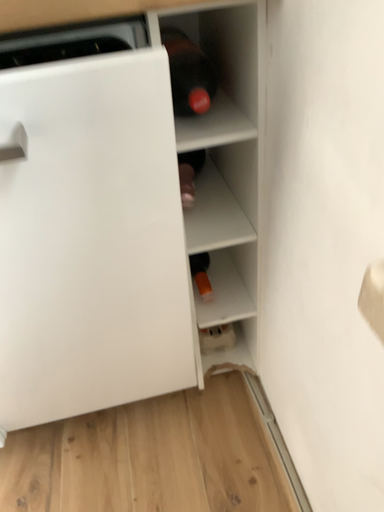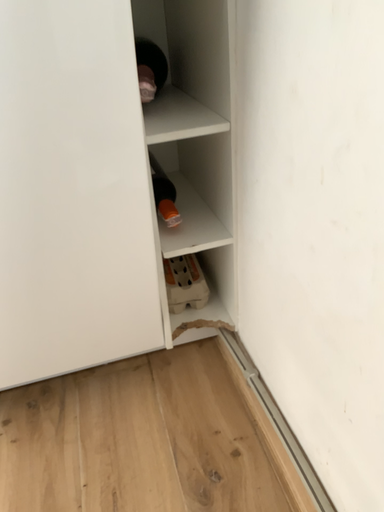
Question: How did the camera likely rotate when shooting the video?

Choices:
 (A) rotated upward
 (B) rotated downward

Answer: (A)